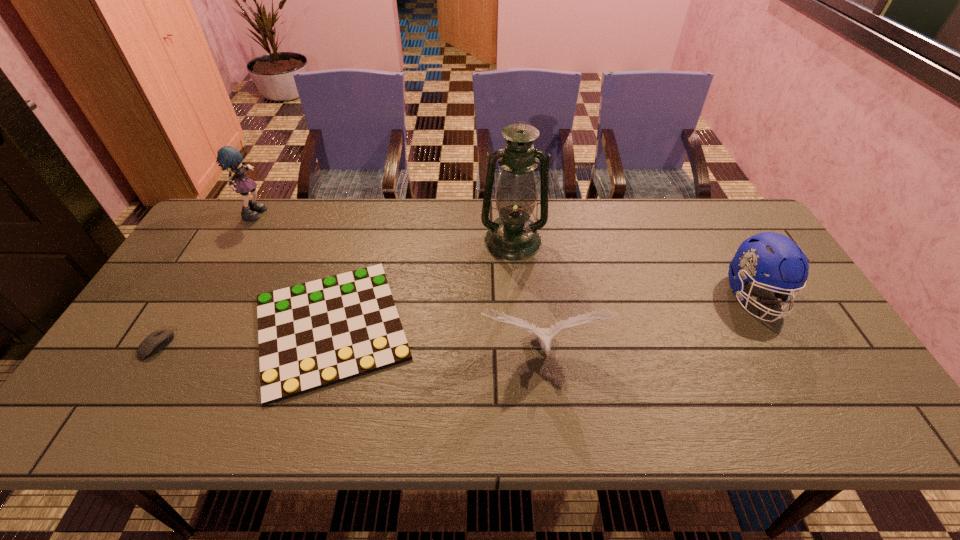
Find the location of `free area in between the football helmet and the gull`. free area in between the football helmet and the gull is located at coordinates (648, 324).

I want to click on free spot between the football helmet and the second farthest object, so click(x=634, y=268).

Find the location of `object identified as the second closest to the oil lamp`. object identified as the second closest to the oil lamp is located at coordinates (545, 336).

Identify the location of object that is the closest to the gull. The height and width of the screenshot is (540, 960). (311, 335).

Locate an element on the screen. This screenshot has height=540, width=960. vacant region that satisfies the following two spatial constraints: 1. on the front-facing side of the farthest object; 2. on the left side of the fourth object from right to left is located at coordinates (190, 327).

You are a GUI agent. You are given a task and a screenshot of the screen. Output one action in this format:
    pyautogui.click(x=<x>, y=<y>)
    Task: Click on the free space in the image that satisfies the following two spatial constraints: 1. on the back side of the checkerboard; 2. on the front-facing side of the farthest object
    
    Given the screenshot: What is the action you would take?
    pyautogui.click(x=365, y=211)

At what (x,y) coordinates should I click in order to perform the action: click on vacant area in the image that satisfies the following two spatial constraints: 1. on the front-facing side of the farthest object; 2. on the left side of the second farthest object. Please return your answer as a coordinate pair (x, y). Image resolution: width=960 pixels, height=540 pixels. Looking at the image, I should click on (239, 240).